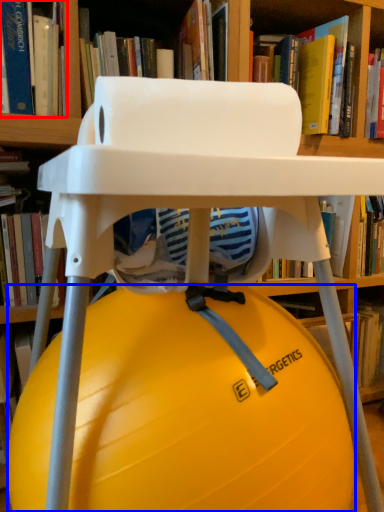
Question: Which point is further to the camera, book (highlighted by a red box) or ball (highlighted by a blue box)?

Choices:
 (A) book
 (B) ball

Answer: (A)